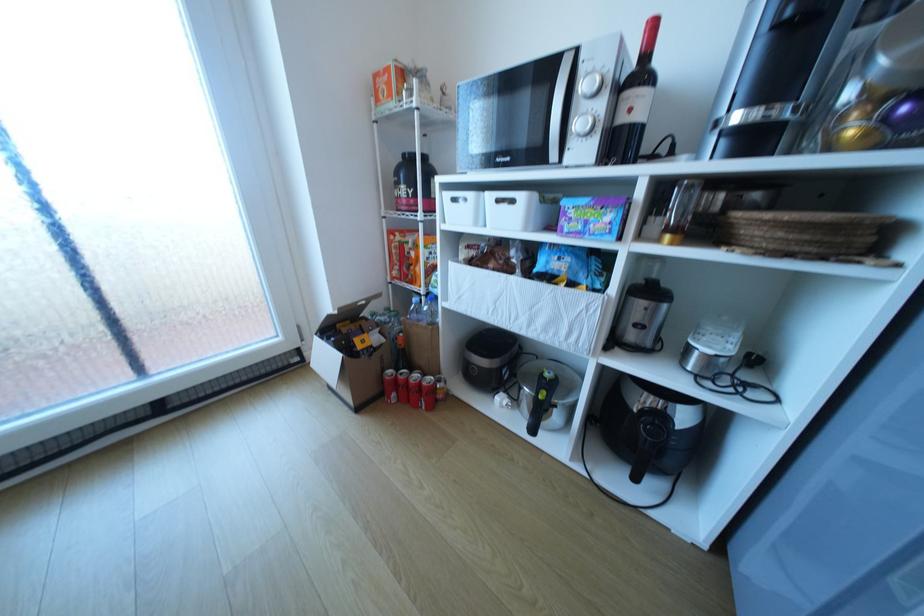
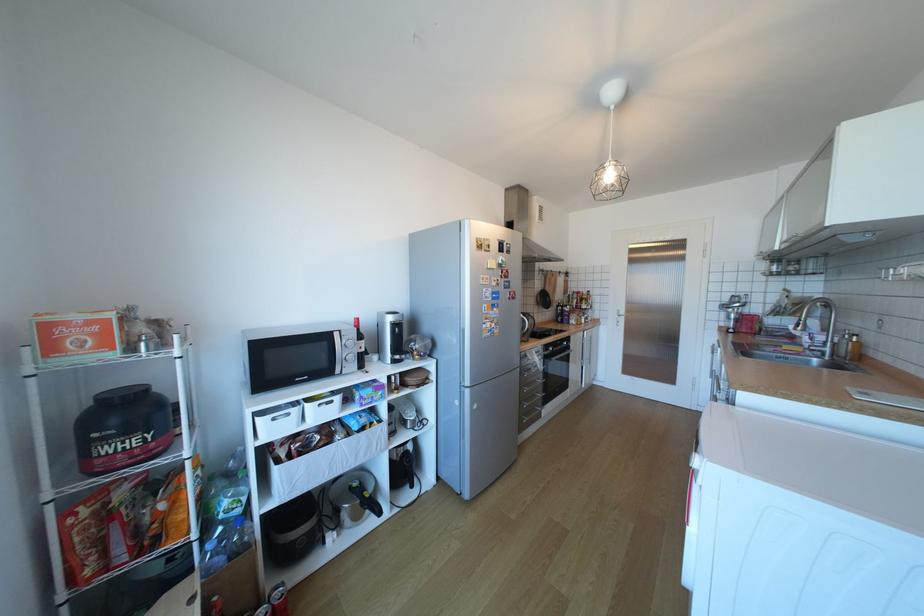
Where in the second image is the point corresponding to point 417,192 from the first image?

(152, 439)